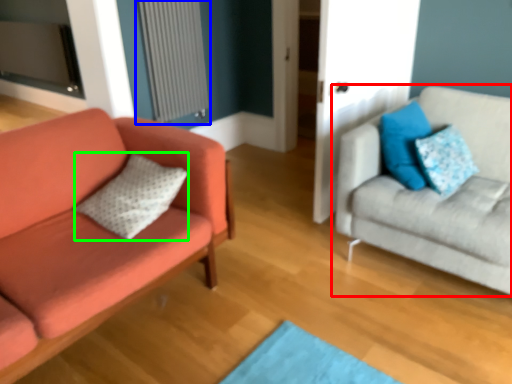
Question: Based on their relative distances, which object is farther from studio couch (highlighted by a red box)? Choose from radiator (highlighted by a blue box) and pillow (highlighted by a green box).

Choices:
 (A) radiator
 (B) pillow

Answer: (A)